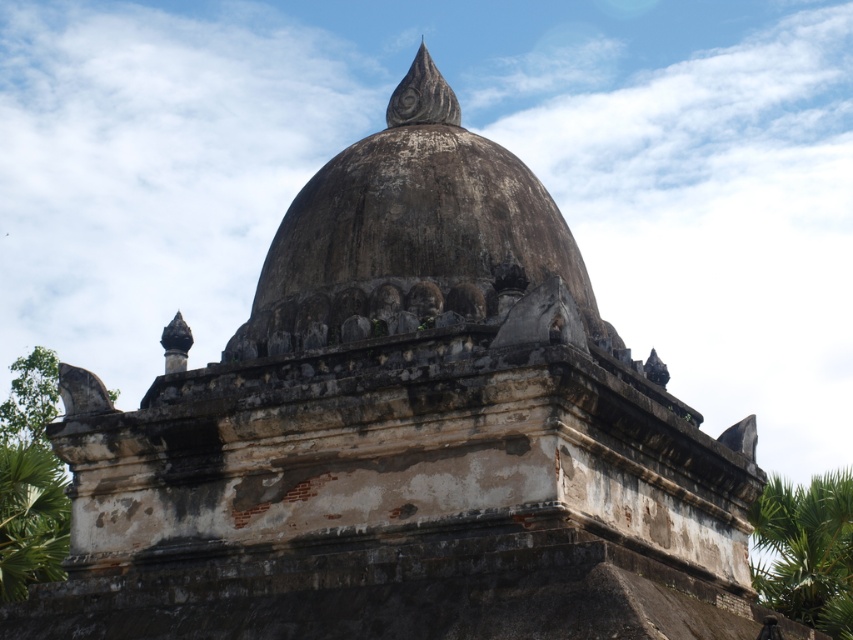
Question: Does weathered stone dome at center have a larger size compared to green leafy palm tree at right?

Choices:
 (A) no
 (B) yes

Answer: (A)

Question: Which point is farther from the camera taking this photo?

Choices:
 (A) (38, 451)
 (B) (781, 493)
 (C) (238, 348)

Answer: (B)

Question: Considering the relative positions of green leafy palm tree at right and green leafy palm tree at lower left in the image provided, where is green leafy palm tree at right located with respect to green leafy palm tree at lower left?

Choices:
 (A) above
 (B) below

Answer: (B)

Question: Which object is positioned closest to the green leafy palm tree at lower left?

Choices:
 (A) green leafy palm tree at right
 (B) weathered stone dome at center

Answer: (B)

Question: Is green leafy palm tree at right bigger than green leafy palm tree at lower left?

Choices:
 (A) yes
 (B) no

Answer: (A)

Question: Estimate the real-world distances between objects in this image. Which object is closer to the green leafy palm tree at right?

Choices:
 (A) green leafy palm tree at lower left
 (B) weathered stone dome at center

Answer: (B)